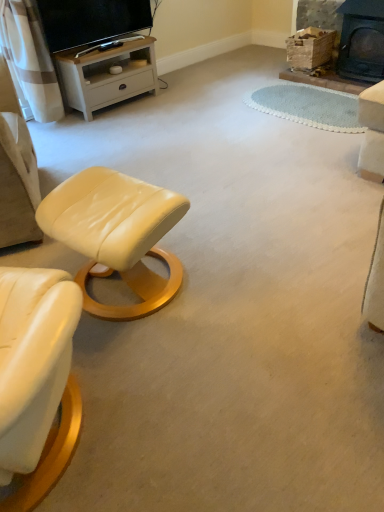
This screenshot has height=512, width=384. What do you see at coordinates (116, 234) in the screenshot?
I see `matte cream leather stool at lower left` at bounding box center [116, 234].

Locate an element on the screen. black cast iron fireplace at upper right is located at coordinates (362, 40).

The height and width of the screenshot is (512, 384). Describe the element at coordinates (107, 75) in the screenshot. I see `white wood tv stand at upper left` at that location.

At what (x,y) coordinates should I click in order to perform the action: click on matte black tv at upper left. Please return your answer as a coordinate pair (x, y). Looking at the image, I should click on (91, 22).

Which of these two, white wood tv stand at upper left or black cast iron fireplace at upper right, stands taller?

With more height is black cast iron fireplace at upper right.

Does white wood tv stand at upper left turn towards black cast iron fireplace at upper right?

No, white wood tv stand at upper left is not facing towards black cast iron fireplace at upper right.

From the image's perspective, does white wood tv stand at upper left appear lower than black cast iron fireplace at upper right?

Yes, from the image's perspective, white wood tv stand at upper left is beneath black cast iron fireplace at upper right.

Is white wood tv stand at upper left directly adjacent to black cast iron fireplace at upper right?

No, white wood tv stand at upper left is not with black cast iron fireplace at upper right.

From the image's perspective, would you say white wood tv stand at upper left is positioned over matte black tv at upper left?

No, from the image's perspective, white wood tv stand at upper left is not on top of matte black tv at upper left.

How distant is white wood tv stand at upper left from matte black tv at upper left?

A distance of 8.31 inches exists between white wood tv stand at upper left and matte black tv at upper left.

Which object is positioned more to the left, white wood tv stand at upper left or matte black tv at upper left?

Positioned to the left is matte black tv at upper left.

In terms of width, does white wood tv stand at upper left look wider or thinner when compared to matte black tv at upper left?

white wood tv stand at upper left is wider than matte black tv at upper left.

Is matte black tv at upper left aimed at matte cream leather stool at lower left?

Yes, matte black tv at upper left is aimed at matte cream leather stool at lower left.

Between point (78, 33) and point (169, 225), which one is positioned in front?

The point (169, 225) is closer.

Where is `television on the left of matte cream leather stool at lower left`? This screenshot has width=384, height=512. television on the left of matte cream leather stool at lower left is located at coordinates (91, 22).

From a real-world perspective, is matte black tv at upper left positioned above or below matte cream leather stool at lower left?

From a real-world perspective, matte black tv at upper left is physically above matte cream leather stool at lower left.

Is matte cream leather stool at lower left in front of black cast iron fireplace at upper right?

Yes, it is in front of black cast iron fireplace at upper right.

Is matte cream leather stool at lower left positioned with its back to black cast iron fireplace at upper right?

matte cream leather stool at lower left does not have its back to black cast iron fireplace at upper right.

From the image's perspective, does matte cream leather stool at lower left appear lower than black cast iron fireplace at upper right?

Yes, from the image's perspective, matte cream leather stool at lower left is beneath black cast iron fireplace at upper right.

Which is in front, point (135, 192) or point (349, 64)?

The point (135, 192) is closer to the camera.

Is matte cream leather stool at lower left at the left side of matte black tv at upper left?

In fact, matte cream leather stool at lower left is to the right of matte black tv at upper left.

Which point is more distant from viewer, (136,312) or (91,3)?

The point (91,3) is farther from the camera.

Consider the image. Is there a large distance between matte cream leather stool at lower left and matte black tv at upper left?

Yes, matte cream leather stool at lower left and matte black tv at upper left are located far from each other.

From the image's perspective, is matte cream leather stool at lower left located beneath matte black tv at upper left?

Yes.

Considering the sizes of objects matte black tv at upper left and black cast iron fireplace at upper right in the image provided, who is wider, matte black tv at upper left or black cast iron fireplace at upper right?

black cast iron fireplace at upper right is wider.

Can you confirm if matte black tv at upper left is smaller than black cast iron fireplace at upper right?

Incorrect, matte black tv at upper left is not smaller in size than black cast iron fireplace at upper right.

Consider the image. From the image's perspective, relative to black cast iron fireplace at upper right, is matte black tv at upper left above or below?

From the image's perspective, matte black tv at upper left appears above black cast iron fireplace at upper right.

Is matte black tv at upper left placed right next to black cast iron fireplace at upper right?

matte black tv at upper left and black cast iron fireplace at upper right are clearly separated.

Are black cast iron fireplace at upper right and white wood tv stand at upper left located far from each other?

Yes, black cast iron fireplace at upper right is far from white wood tv stand at upper left.

Considering the relative positions of black cast iron fireplace at upper right and white wood tv stand at upper left in the image provided, is black cast iron fireplace at upper right to the left of white wood tv stand at upper left from the viewer's perspective?

No.

Considering the sizes of objects black cast iron fireplace at upper right and white wood tv stand at upper left in the image provided, who is thinner, black cast iron fireplace at upper right or white wood tv stand at upper left?

black cast iron fireplace at upper right.

Where is `fireplace above the white wood tv stand at upper left (from a real-world perspective)`? Image resolution: width=384 pixels, height=512 pixels. fireplace above the white wood tv stand at upper left (from a real-world perspective) is located at coordinates click(x=362, y=40).

Find the location of a particular element. The width and height of the screenshot is (384, 512). television on the left of white wood tv stand at upper left is located at coordinates (91, 22).

Which object lies nearer to the anchor point matte cream leather stool at lower left, matte black tv at upper left or white wood tv stand at upper left?

white wood tv stand at upper left lies closer to matte cream leather stool at lower left than the other object.

Based on their spatial positions, is black cast iron fireplace at upper right or white wood tv stand at upper left closer to matte black tv at upper left?

Based on the image, white wood tv stand at upper left appears to be nearer to matte black tv at upper left.

Looking at the image, which one is located further to matte cream leather stool at lower left, white wood tv stand at upper left or matte black tv at upper left?

matte black tv at upper left.

Looking at the image, which one is located closer to white wood tv stand at upper left, matte black tv at upper left or black cast iron fireplace at upper right?

The object closer to white wood tv stand at upper left is matte black tv at upper left.

Estimate the real-world distances between objects in this image. Which object is further from white wood tv stand at upper left, matte black tv at upper left or matte cream leather stool at lower left?

Based on the image, matte cream leather stool at lower left appears to be further to white wood tv stand at upper left.

Considering their positions, is white wood tv stand at upper left positioned further to black cast iron fireplace at upper right than matte black tv at upper left?

matte black tv at upper left.

Based on their spatial positions, is black cast iron fireplace at upper right or matte black tv at upper left closer to matte cream leather stool at lower left?

Among the two, matte black tv at upper left is located nearer to matte cream leather stool at lower left.

Estimate the real-world distances between objects in this image. Which object is closer to matte black tv at upper left, matte cream leather stool at lower left or black cast iron fireplace at upper right?

Among the two, black cast iron fireplace at upper right is located nearer to matte black tv at upper left.

You are a GUI agent. You are given a task and a screenshot of the screen. Output one action in this format:
    pyautogui.click(x=<x>, y=<y>)
    Task: Click on the stool between white wood tv stand at upper left and black cast iron fireplace at upper right
    The height and width of the screenshot is (512, 384).
    Given the screenshot: What is the action you would take?
    pyautogui.click(x=116, y=234)

Find the location of a particular element. The height and width of the screenshot is (512, 384). stool between matte black tv at upper left and black cast iron fireplace at upper right from left to right is located at coordinates (116, 234).

The image size is (384, 512). I want to click on television between matte cream leather stool at lower left and white wood tv stand at upper left along the z-axis, so click(91, 22).

This screenshot has width=384, height=512. Find the location of `desk between matte black tv at upper left and black cast iron fireplace at upper right in the horizontal direction`. desk between matte black tv at upper left and black cast iron fireplace at upper right in the horizontal direction is located at coordinates (107, 75).